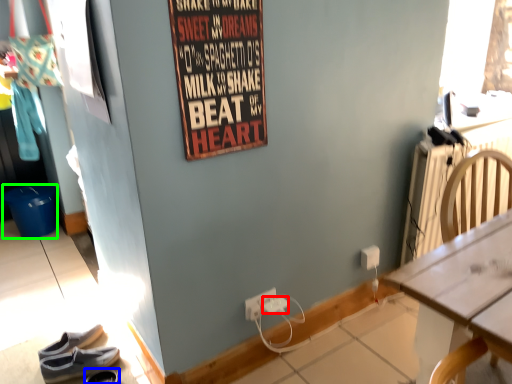
Question: Considering the real-world distances, which object is farthest from power outlet (highlighted by a red box)? footwear (highlighted by a blue box) or bucket (highlighted by a green box)?

Choices:
 (A) footwear
 (B) bucket

Answer: (B)